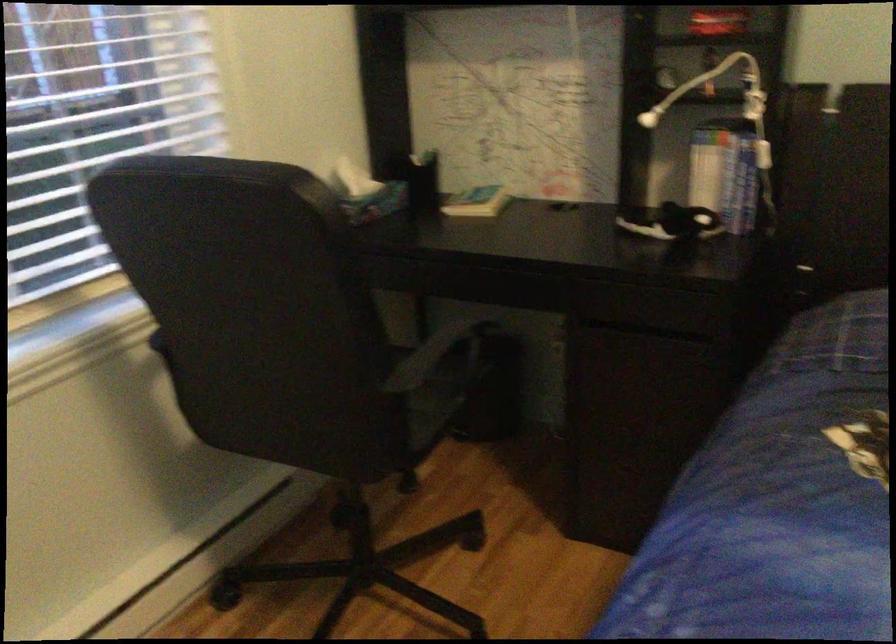
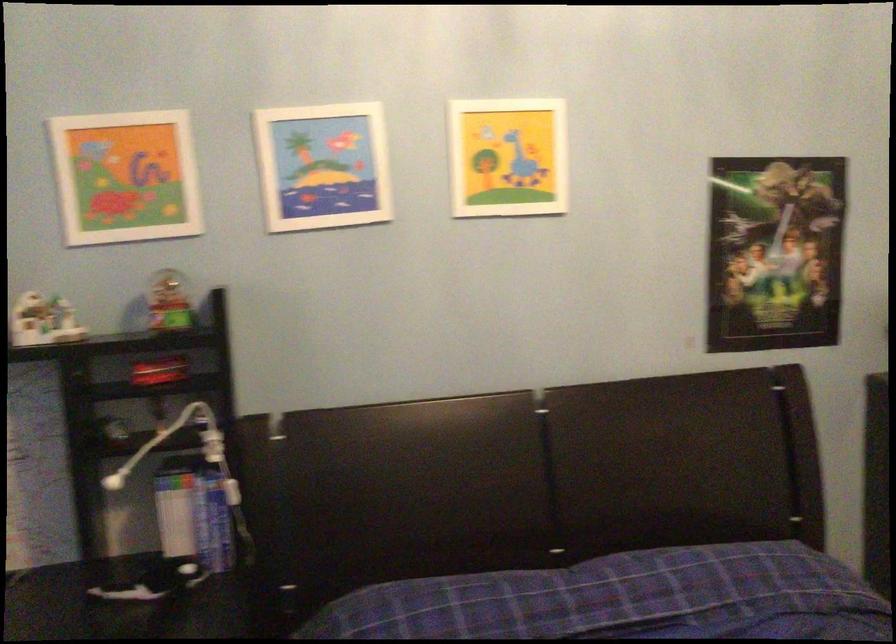
Question: The images are taken continuously from a first-person perspective. In which direction is your viewpoint rotating?

Choices:
 (A) Left
 (B) Right
 (C) Up
 (D) Down

Answer: (B)